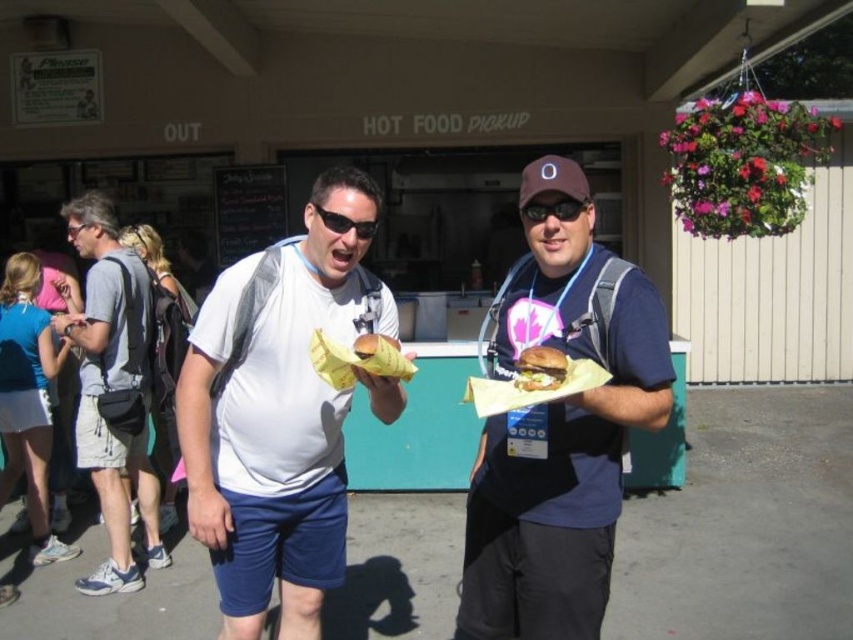
You are a photographer trying to capture both the black plastic goggles at center and the black plastic sunglasses at center in a single frame. Based on their positions, which object should you focus on first to ensure both are in the shot?

Since the black plastic goggles at center is to the right of the black plastic sunglasses at center, you should focus on the black plastic sunglasses at center first as it is on the left side, ensuring both objects remain within the frame when centered.

What are the coordinates of the white matte shirt at center?

The white matte shirt at center is located at coordinates point (277, 413).